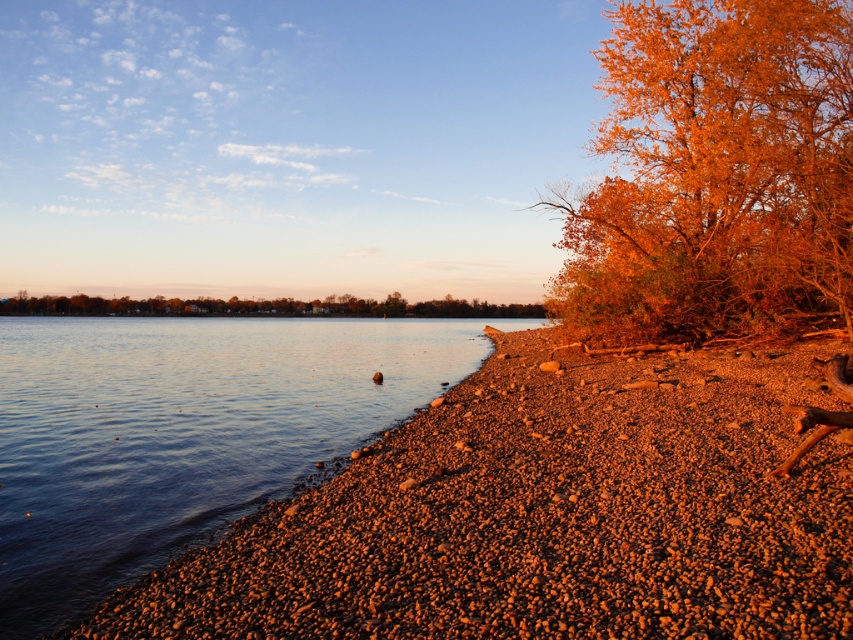
You are standing at the edge of the lake and want to walk from the smooth water at lower left to the orange matte tree at center. Which direction should you move to get closer to the tree?

To move closer to the orange matte tree at center from the smooth water at lower left, you should walk towards the center of the image since the tree is positioned centrally and the water is at the lower left.